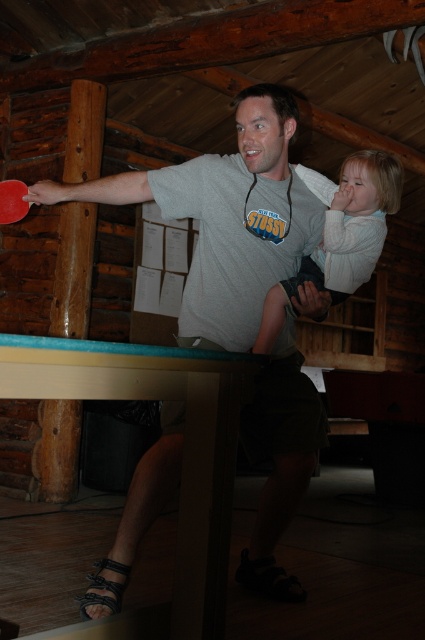
Does point (380, 237) lie behind point (25, 205)?

Yes, point (380, 237) is farther from viewer.

Looking at this image, does white soft sweater at upper right have a lesser width compared to red plastic paddle at left?

Incorrect, white soft sweater at upper right's width is not less than red plastic paddle at left's.

Is point (374, 220) closer to viewer compared to point (14, 193)?

No, it is not.

Find the location of a particular element. white soft sweater at upper right is located at coordinates (340, 234).

Can you confirm if matte gray t-shirt at center is shorter than white soft sweater at upper right?

In fact, matte gray t-shirt at center may be taller than white soft sweater at upper right.

From the picture: Is matte gray t-shirt at center to the right of white soft sweater at upper right from the viewer's perspective?

Incorrect, matte gray t-shirt at center is not on the right side of white soft sweater at upper right.

Is point (251, 257) positioned after point (337, 280)?

No, it is not.

Locate an element on the screen. The image size is (425, 640). matte gray t-shirt at center is located at coordinates (226, 218).

Is matte gray t-shirt at center above red plastic paddle at left?

Incorrect, matte gray t-shirt at center is not positioned above red plastic paddle at left.

Can you confirm if matte gray t-shirt at center is bigger than red plastic paddle at left?

Indeed, matte gray t-shirt at center has a larger size compared to red plastic paddle at left.

Which is in front, point (272, 243) or point (19, 209)?

Point (272, 243) is in front.

Image resolution: width=425 pixels, height=640 pixels. In order to click on matte gray t-shirt at center in this screenshot , I will do 226,218.